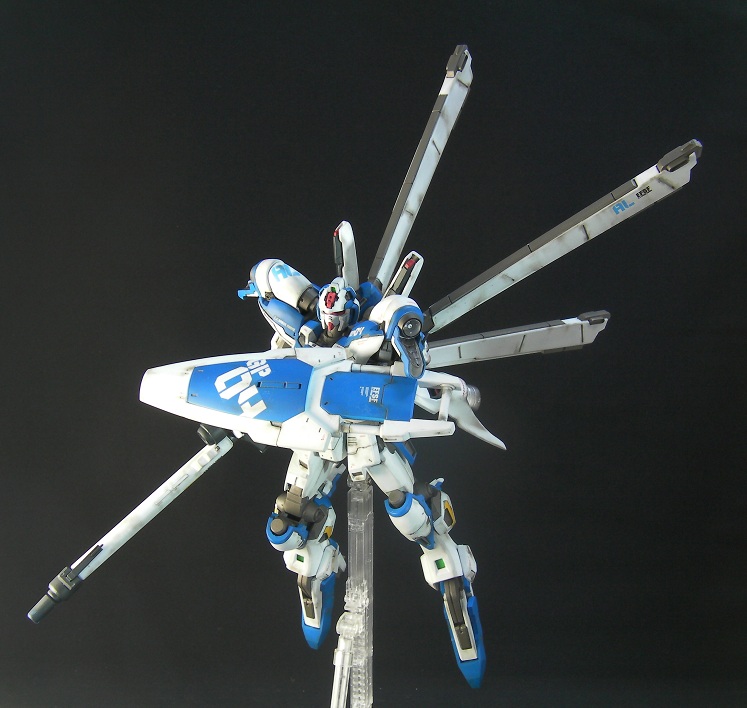
This screenshot has width=747, height=708. What are the coordinates of `blue feet of toy` in the screenshot? It's located at (306, 631), (473, 670).